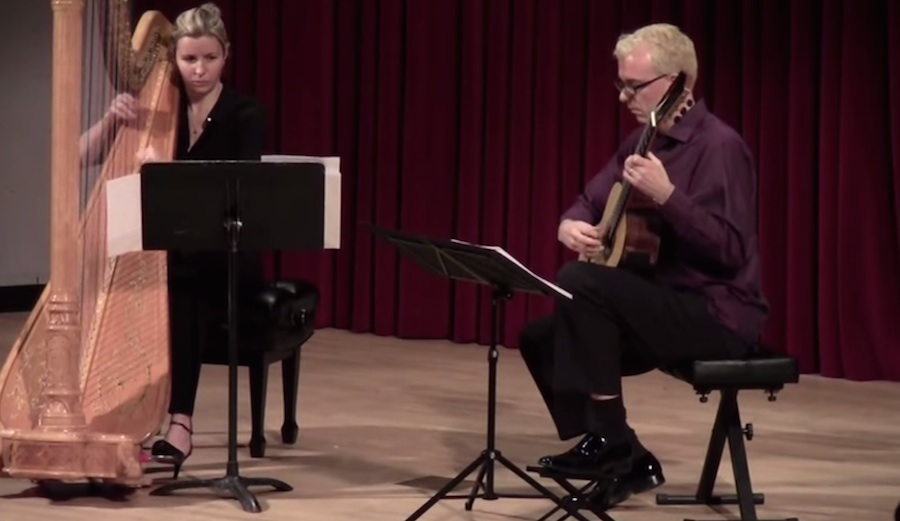
Find the location of `wooden floor`. wooden floor is located at coordinates (834, 427).